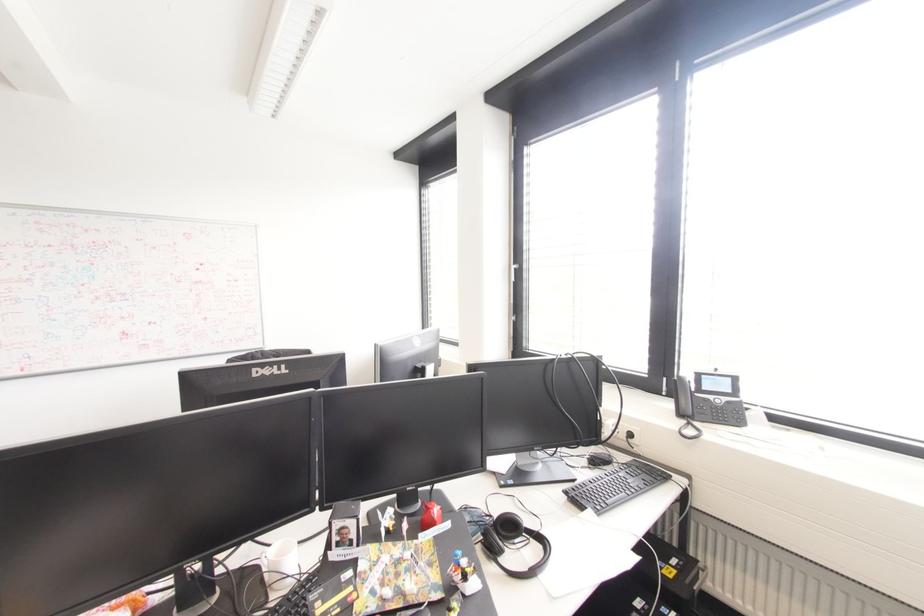
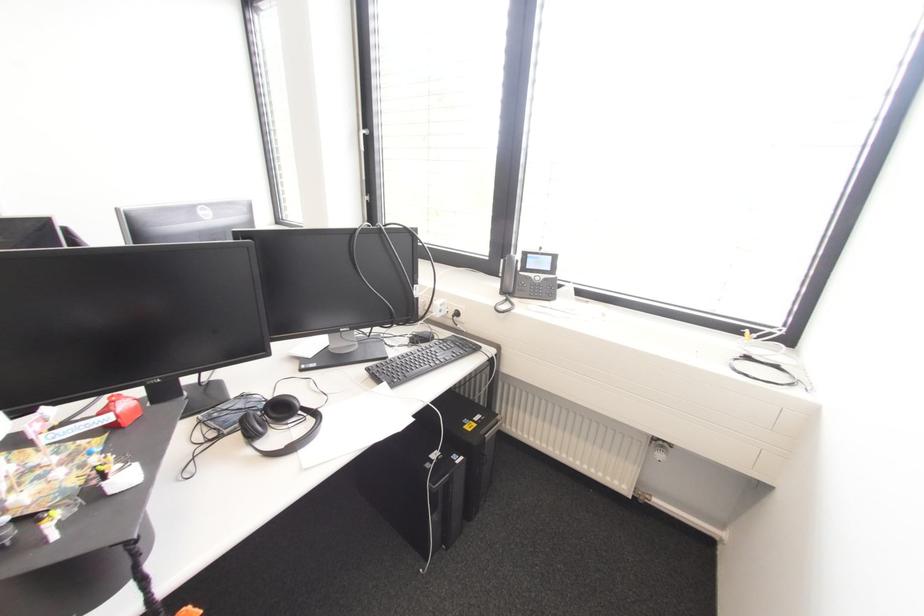
Locate, in the second image, the point that corresponds to the point at 508,525 in the first image.

(281, 408)